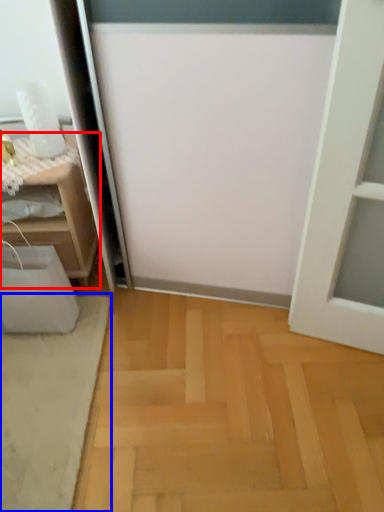
Question: Which of the following is the closest to the observer, furniture (highlighted by a red box) or doormat (highlighted by a blue box)?

Choices:
 (A) furniture
 (B) doormat

Answer: (B)